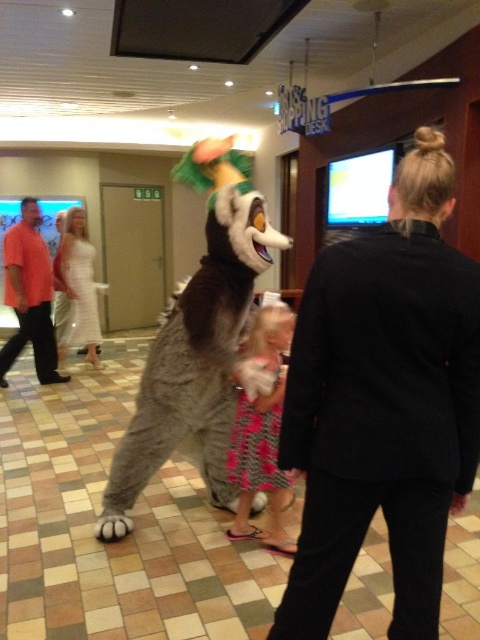
Question: Can you confirm if pink fabric dress at center is positioned above pink textured dress at center?

Choices:
 (A) no
 (B) yes

Answer: (B)

Question: Which of the following is the farthest from the observer?

Choices:
 (A) pink fabric dress at center
 (B) black textured blazer at center
 (C) white satin dress at center

Answer: (C)

Question: From the image, what is the correct spatial relationship of black textured blazer at center in relation to orange cotton shirt at center?

Choices:
 (A) left
 (B) right

Answer: (B)

Question: In this image, where is fuzzy gray costume at center located relative to pink fabric dress at center?

Choices:
 (A) right
 (B) left

Answer: (B)

Question: Estimate the real-world distances between objects in this image. Which object is closer to the pink textured dress at center?

Choices:
 (A) pink fabric dress at center
 (B) white satin dress at center

Answer: (A)

Question: Which of the following is the closest to the observer?

Choices:
 (A) black textured blazer at center
 (B) pink textured dress at center

Answer: (A)